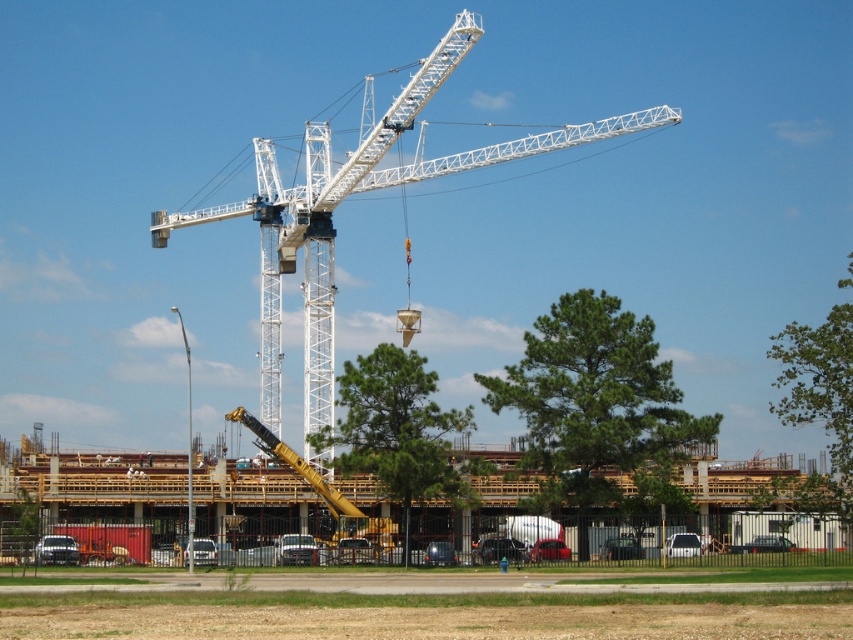
Question: Is wooden frame at center bigger than metallic yellow crane arm at center?

Choices:
 (A) no
 (B) yes

Answer: (B)

Question: Estimate the real-world distances between objects in this image. Which object is closer to the yellow metallic crane at center?

Choices:
 (A) matte black truck at lower left
 (B) metallic yellow crane arm at center
 (C) white metallic truck at lower right
 (D) white metallic crane at center

Answer: (B)

Question: Is yellow metallic crane at center bigger than matte black truck at lower left?

Choices:
 (A) no
 (B) yes

Answer: (B)

Question: Can you confirm if white metallic truck at lower right is wider than metallic yellow crane arm at center?

Choices:
 (A) yes
 (B) no

Answer: (A)

Question: Considering the real-world distances, which object is closest to the metallic yellow crane arm at center?

Choices:
 (A) yellow metallic crane at center
 (B) white metallic truck at lower right
 (C) wooden frame at center

Answer: (A)

Question: Considering the real-world distances, which object is closest to the metallic yellow crane arm at center?

Choices:
 (A) white metallic truck at lower right
 (B) white metallic crane at center
 (C) yellow metallic crane at center
 (D) matte black truck at lower left

Answer: (D)